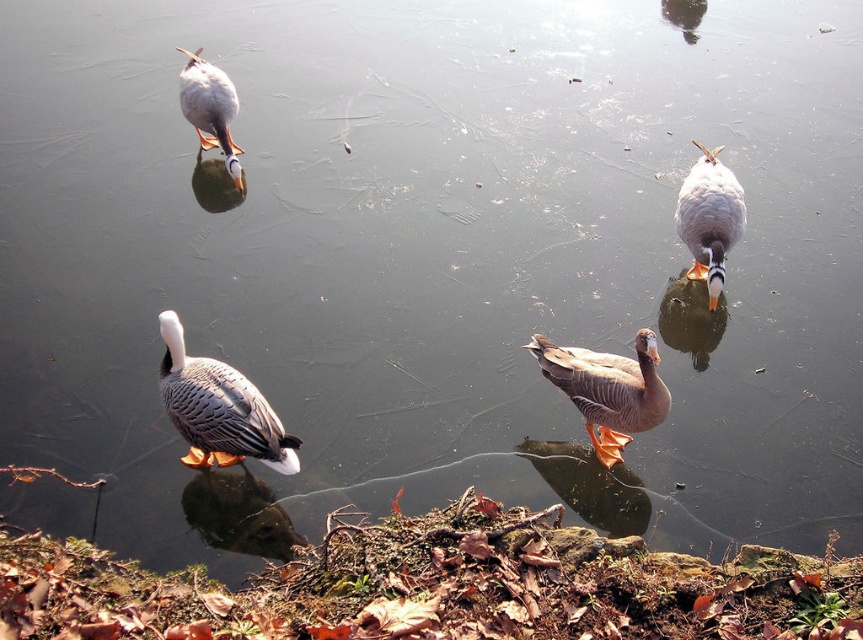
Question: Which point is farther to the camera?

Choices:
 (A) speckled feathered duck at upper left
 (B) speckled feathered duck at center
 (C) white glossy duck at upper right
 (D) gray matte duck at center

Answer: (A)

Question: Based on their relative distances, which object is nearer to the speckled feathered duck at upper left?

Choices:
 (A) white glossy duck at upper right
 (B) speckled feathered duck at center
 (C) gray matte duck at center

Answer: (B)

Question: Which of the following is the farthest from the observer?

Choices:
 (A) speckled feathered duck at center
 (B) speckled feathered duck at upper left

Answer: (B)

Question: Does gray matte duck at center appear on the right side of speckled feathered duck at upper left?

Choices:
 (A) no
 (B) yes

Answer: (B)

Question: Does gray matte duck at center appear on the left side of speckled feathered duck at upper left?

Choices:
 (A) yes
 (B) no

Answer: (B)

Question: Does gray matte duck at center appear on the right side of speckled feathered duck at upper left?

Choices:
 (A) no
 (B) yes

Answer: (B)